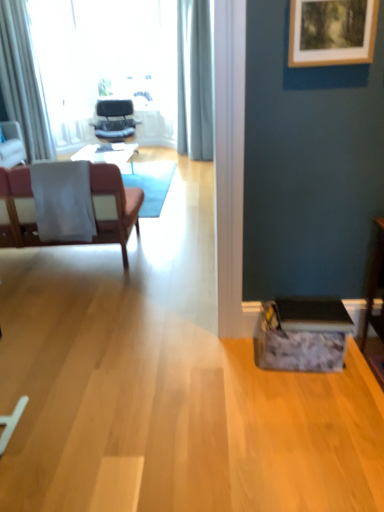
Question: Can you confirm if pink fabric chair at left, which appears as the first chair when ordered from the bottom, is taller than light gray fabric curtain at upper center, acting as the second curtain starting from the left?

Choices:
 (A) no
 (B) yes

Answer: (A)

Question: Can you confirm if pink fabric chair at left, which appears as the first chair when ordered from the bottom, is shorter than light gray fabric curtain at upper center, acting as the second curtain starting from the left?

Choices:
 (A) no
 (B) yes

Answer: (B)

Question: Could light gray fabric curtain at upper center, acting as the second curtain starting from the left, be considered to be inside pink fabric chair at left, the third chair from the left?

Choices:
 (A) no
 (B) yes

Answer: (A)

Question: Can you confirm if pink fabric chair at left, which appears as the first chair when ordered from the bottom, is smaller than light gray fabric curtain at upper center, the 1th curtain positioned from the right?

Choices:
 (A) yes
 (B) no

Answer: (B)

Question: From a real-world perspective, does pink fabric chair at left, the 3th chair when ordered from back to front, sit lower than light gray fabric curtain at upper center, the 1th curtain positioned from the right?

Choices:
 (A) no
 (B) yes

Answer: (B)

Question: From the image's perspective, is pink fabric chair at left, which appears as the first chair when ordered from the bottom, on top of light gray fabric curtain at upper center, the 1th curtain positioned from the right?

Choices:
 (A) no
 (B) yes

Answer: (A)

Question: Is white sheer curtain at left, the first curtain when ordered from left to right, next to matte pink chair at left, which ranks as the second chair in back-to-front order?

Choices:
 (A) yes
 (B) no

Answer: (B)

Question: Is white sheer curtain at left, the 2th curtain in the right-to-left sequence, far from matte pink chair at left, which ranks as the second chair in back-to-front order?

Choices:
 (A) yes
 (B) no

Answer: (B)

Question: From the image's perspective, is white sheer curtain at left, the 2th curtain in the right-to-left sequence, on top of matte pink chair at left, positioned as the second chair in front-to-back order?

Choices:
 (A) no
 (B) yes

Answer: (B)

Question: From a real-world perspective, is white sheer curtain at left, the first curtain when ordered from left to right, on matte pink chair at left, which is counted as the 1th chair, starting from the left?

Choices:
 (A) yes
 (B) no

Answer: (A)

Question: Is white sheer curtain at left, the first curtain when ordered from left to right, taller than matte pink chair at left, which ranks as the second chair in back-to-front order?

Choices:
 (A) no
 (B) yes

Answer: (B)

Question: Could you tell me if white sheer curtain at left, the 2th curtain in the right-to-left sequence, is turned towards matte pink chair at left, which ranks as the second chair in back-to-front order?

Choices:
 (A) yes
 (B) no

Answer: (B)

Question: Considering the relative positions of light gray fabric curtain at upper center, the 1th curtain positioned from the right, and matte black chair at center, which appears as the 1th chair when viewed from the top, in the image provided, is light gray fabric curtain at upper center, the 1th curtain positioned from the right, to the left of matte black chair at center, which appears as the 1th chair when viewed from the top, from the viewer's perspective?

Choices:
 (A) yes
 (B) no

Answer: (B)